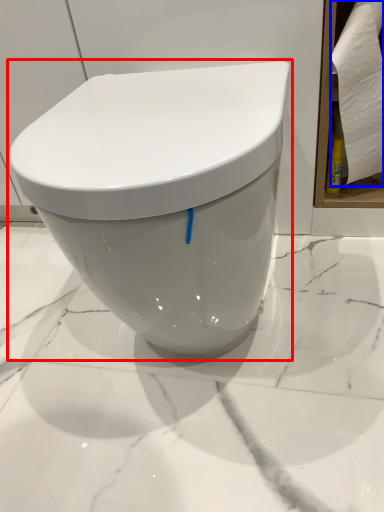
Question: Which object appears closest to the camera in this image, toilet (highlighted by a red box) or toilet paper (highlighted by a blue box)?

Choices:
 (A) toilet
 (B) toilet paper

Answer: (A)